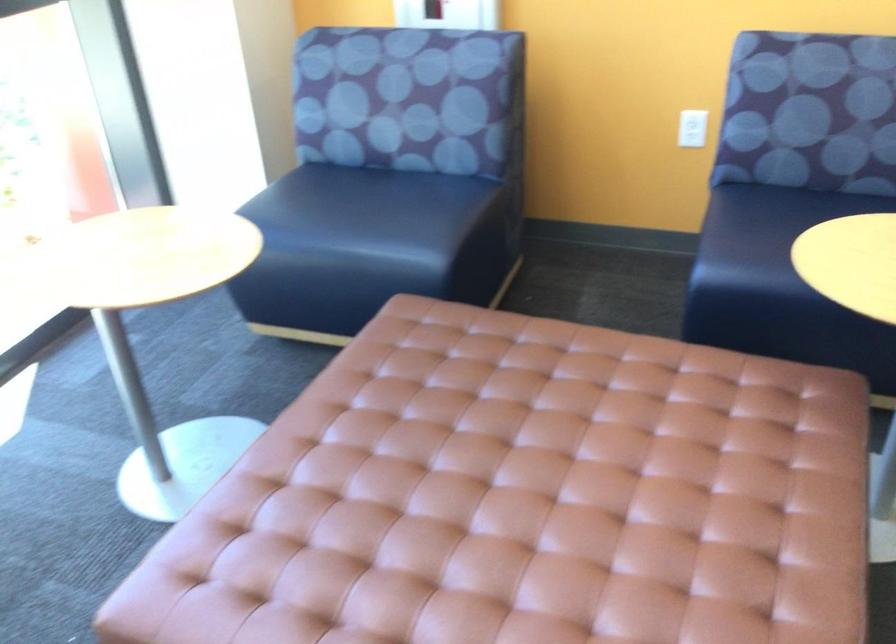
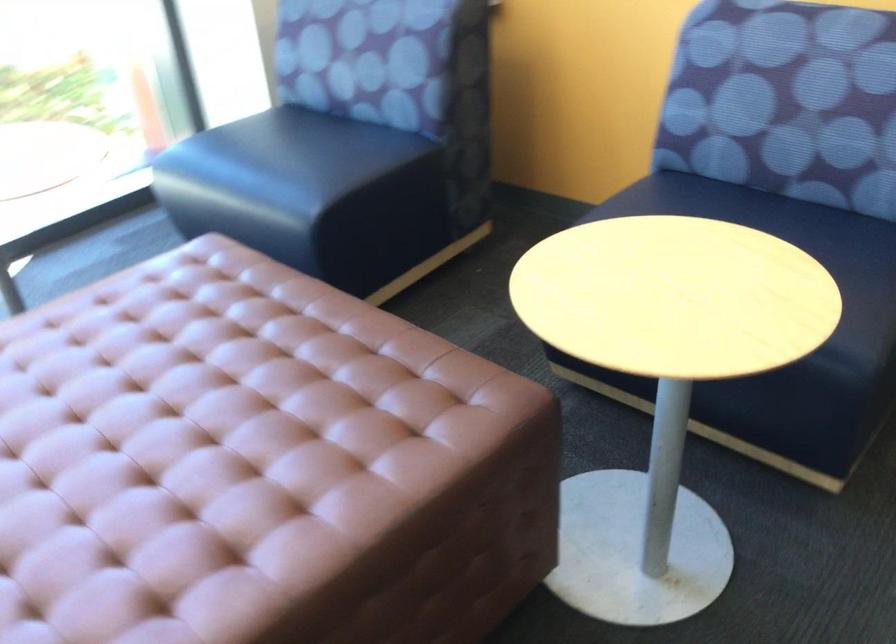
Question: The camera is either moving clockwise (left) or counter-clockwise (right) around the object. The first image is from the beginning of the video and the second image is from the end. Is the camera moving left or right when shooting the video?

Choices:
 (A) Left
 (B) Right

Answer: (B)